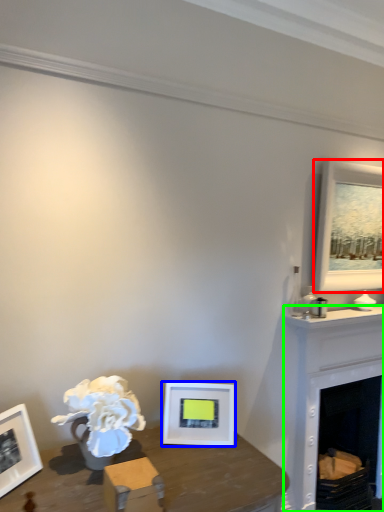
Question: Which object is positioned closest to picture frame (highlighted by a red box)? Select from picture frame (highlighted by a blue box) and fireplace (highlighted by a green box).

Choices:
 (A) picture frame
 (B) fireplace

Answer: (B)